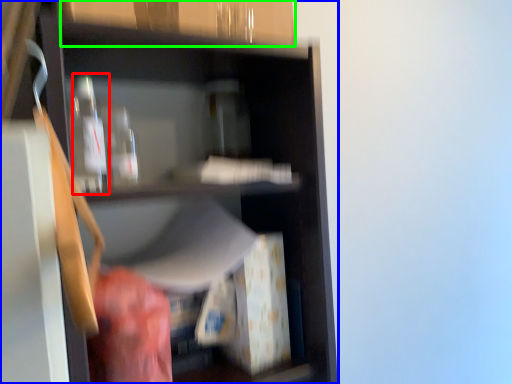
Question: Which object is positioned farthest from bottle (highlighted by a red box)? Select from shelf (highlighted by a blue box) and cabinetry (highlighted by a green box).

Choices:
 (A) shelf
 (B) cabinetry

Answer: (A)